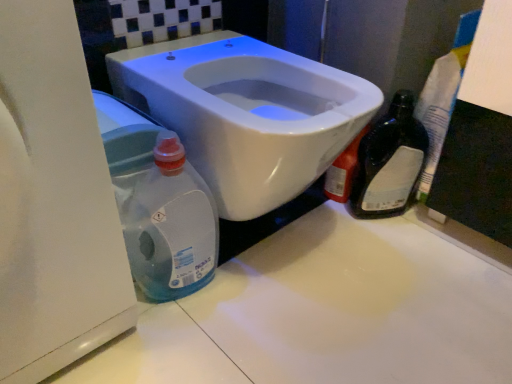
Locate an element on the screen. This screenshot has width=512, height=384. free space to the left of black glass bottle at right is located at coordinates (317, 221).